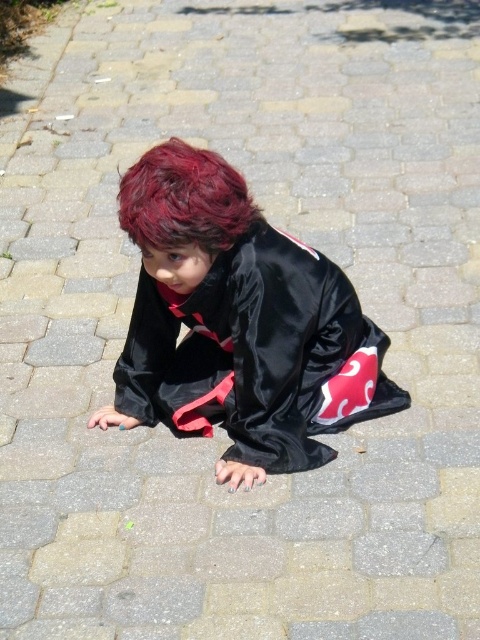
Question: Which of the following is the closest to the observer?

Choices:
 (A) (196, 212)
 (B) (146, 172)

Answer: (A)

Question: Which of the following is the farthest from the observer?

Choices:
 (A) shiny red hair at center
 (B) satin black kimono at center

Answer: (B)

Question: Which point is closer to the camera taking this photo?

Choices:
 (A) (220, 369)
 (B) (218, 205)

Answer: (B)

Question: Does satin black kimono at center appear under shiny red hair at center?

Choices:
 (A) yes
 (B) no

Answer: (A)

Question: Does satin black kimono at center appear over shiny red hair at center?

Choices:
 (A) no
 (B) yes

Answer: (A)

Question: Can you confirm if satin black kimono at center is positioned above shiny red hair at center?

Choices:
 (A) yes
 (B) no

Answer: (B)